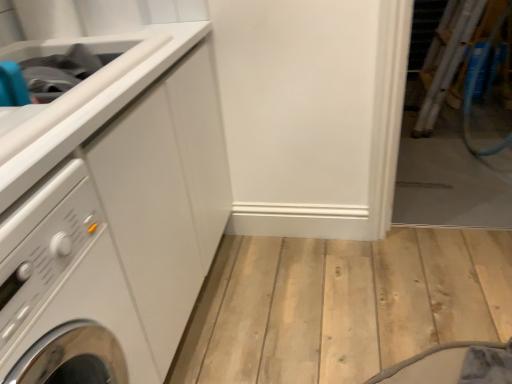
This screenshot has width=512, height=384. What do you see at coordinates (66, 291) in the screenshot?
I see `white glossy washing machine at left` at bounding box center [66, 291].

Locate an element on the screen. The height and width of the screenshot is (384, 512). white glossy washing machine at left is located at coordinates (66, 291).

From a real-world perspective, is white glossy washing machine at left over white glossy counter top at upper left?

No, from a real-world perspective, white glossy washing machine at left is not over white glossy counter top at upper left

Based on the photo, are white glossy washing machine at left and white glossy counter top at upper left beside each other?

white glossy washing machine at left and white glossy counter top at upper left are not in contact.

Is white glossy washing machine at left in front of or behind white glossy counter top at upper left in the image?

white glossy washing machine at left is positioned closer to the viewer than white glossy counter top at upper left.

Considering the relative sizes of white glossy washing machine at left and white glossy counter top at upper left in the image provided, is white glossy washing machine at left shorter than white glossy counter top at upper left?

In fact, white glossy washing machine at left may be taller than white glossy counter top at upper left.

Which of these two, white glossy washing machine at left or matte white sink at upper left, is smaller?

Smaller between the two is matte white sink at upper left.

From the image's perspective, between white glossy washing machine at left and matte white sink at upper left, which one is located above?

matte white sink at upper left is shown above in the image.

How distant is white glossy washing machine at left from matte white sink at upper left?

white glossy washing machine at left and matte white sink at upper left are 14.00 inches apart from each other.

Find the location of `sink lying behind the white glossy washing machine at left`. sink lying behind the white glossy washing machine at left is located at coordinates (106, 78).

From a real-world perspective, which object stands above the other?

matte white sink at upper left, from a real-world perspective.

How different are the orientations of matte white sink at upper left and white glossy washing machine at left in degrees?

1.14 degrees.

Considering the positions of objects matte white sink at upper left and white glossy washing machine at left in the image provided, who is more to the left, matte white sink at upper left or white glossy washing machine at left?

Positioned to the left is matte white sink at upper left.

Is matte white sink at upper left looking in the opposite direction of white glossy washing machine at left?

That's not correct — matte white sink at upper left is not looking away from white glossy washing machine at left.

Which of these two, white glossy counter top at upper left or white glossy washing machine at left, stands taller?

With more height is white glossy washing machine at left.

From the image's perspective, would you say white glossy counter top at upper left is positioned over white glossy washing machine at left?

Yes, from the image's perspective, white glossy counter top at upper left is on top of white glossy washing machine at left.

Identify the location of counter top that appears above the white glossy washing machine at left (from a real-world perspective). (95, 112).

Is white glossy washing machine at left completely or partially inside white glossy counter top at upper left?

No, white glossy washing machine at left is not inside white glossy counter top at upper left.

Is white glossy counter top at upper left spatially inside matte white sink at upper left, or outside of it?

white glossy counter top at upper left cannot be found inside matte white sink at upper left.

From the image's perspective, which one is positioned higher, white glossy counter top at upper left or matte white sink at upper left?

matte white sink at upper left, from the image's perspective.

Does point (39, 146) come closer to viewer compared to point (15, 96)?

Yes, point (39, 146) is closer to viewer.

Can you confirm if matte white sink at upper left is thinner than white glossy counter top at upper left?

Yes.

In the scene shown: What's the angular difference between matte white sink at upper left and white glossy counter top at upper left's facing directions?

matte white sink at upper left and white glossy counter top at upper left are facing 0.000369 degrees away from each other.

Which is in front, matte white sink at upper left or white glossy counter top at upper left?

white glossy counter top at upper left is more forward.

From a real-world perspective, which object rests below the other?

In real-world perspective, matte white sink at upper left is lower.

Find the location of a particular element. The width and height of the screenshot is (512, 384). washing machine below the white glossy counter top at upper left (from the image's perspective) is located at coordinates (66, 291).

This screenshot has width=512, height=384. I want to click on washing machine on the right of matte white sink at upper left, so click(x=66, y=291).

From the image, which object appears to be farther from matte white sink at upper left, white glossy washing machine at left or white glossy counter top at upper left?

white glossy washing machine at left is positioned further to the anchor matte white sink at upper left.

Estimate the real-world distances between objects in this image. Which object is closer to white glossy washing machine at left, matte white sink at upper left or white glossy counter top at upper left?

Based on the image, white glossy counter top at upper left appears to be nearer to white glossy washing machine at left.

Based on their spatial positions, is white glossy counter top at upper left or white glossy washing machine at left further from matte white sink at upper left?

white glossy washing machine at left is further to matte white sink at upper left.

Considering their positions, is matte white sink at upper left positioned closer to white glossy counter top at upper left than white glossy washing machine at left?

matte white sink at upper left lies closer to white glossy counter top at upper left than the other object.

Looking at the image, which one is located closer to white glossy washing machine at left, white glossy counter top at upper left or matte white sink at upper left?

Among the two, white glossy counter top at upper left is located nearer to white glossy washing machine at left.

Looking at the image, which one is located further to white glossy counter top at upper left, white glossy washing machine at left or matte white sink at upper left?

white glossy washing machine at left is positioned further to the anchor white glossy counter top at upper left.

Where is `counter top between matte white sink at upper left and white glossy washing machine at left in the vertical direction`? The height and width of the screenshot is (384, 512). counter top between matte white sink at upper left and white glossy washing machine at left in the vertical direction is located at coordinates (95, 112).